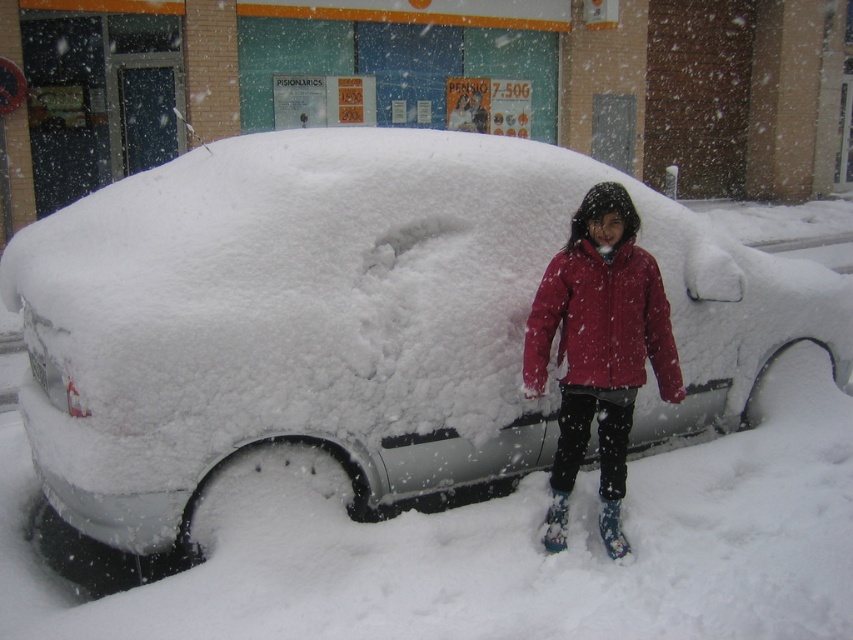
You are a delivery person who needs to place a package on top of the white matte car at center. The package is as tall as the blue fabric ski boot at lower center. Can the package fit on the car without exceeding its height?

The white matte car at center is much taller than the blue fabric ski boot at lower center. Since the package is as tall as the boot, it will easily fit on the car without exceeding its height.